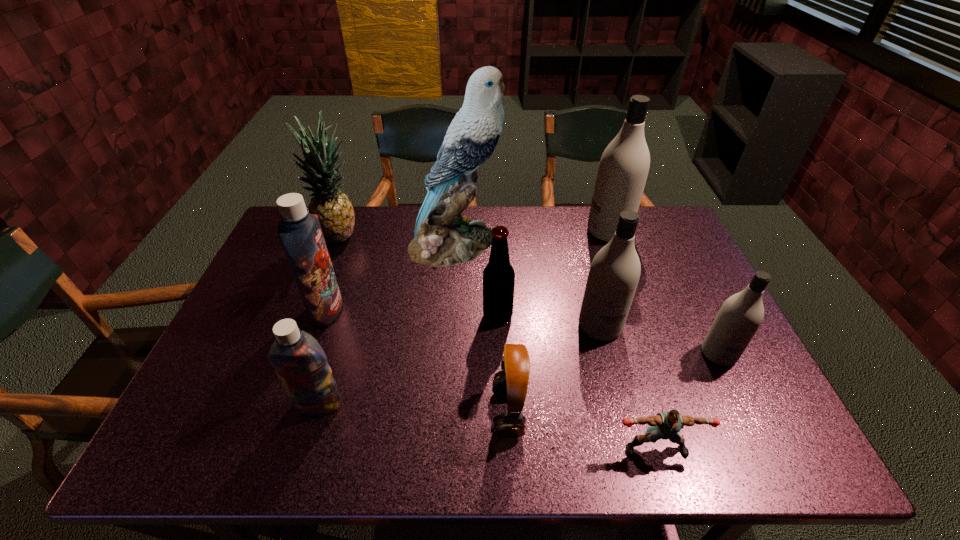
You are a GUI agent. You are given a task and a screenshot of the screen. Output one action in this format:
    pyautogui.click(x=<x>, y=<y>)
    Task: Click on the headset that is at the near edge
    
    Given the screenshot: What is the action you would take?
    pyautogui.click(x=510, y=383)

Where is `puncher that is at the near edge`? This screenshot has width=960, height=540. puncher that is at the near edge is located at coordinates (665, 425).

You are a GUI agent. You are given a task and a screenshot of the screen. Output one action in this format:
    pyautogui.click(x=<x>, y=<y>)
    Task: Click on the object that is at the left edge
    This screenshot has width=960, height=540.
    Given the screenshot: What is the action you would take?
    pyautogui.click(x=335, y=212)

Find the location of a particular element. Image resolution: width=960 pixels, height=540 pixels. object present at the far left corner is located at coordinates (335, 212).

The height and width of the screenshot is (540, 960). In order to click on object that is positioned at the far right corner in this screenshot , I will do `click(624, 165)`.

Where is `free space at the far edge of the desktop`? The image size is (960, 540). free space at the far edge of the desktop is located at coordinates (594, 243).

Find the location of `free space at the near edge of the desktop`. free space at the near edge of the desktop is located at coordinates tap(563, 453).

This screenshot has width=960, height=540. What are the coordinates of `vacant area at the left edge` in the screenshot? It's located at pos(289,266).

Find the location of a particular element. Image resolution: width=960 pixels, height=540 pixels. free location at the right edge is located at coordinates (689, 262).

In the image, there is a desktop. Where is `vacant area at the far right corner`? The height and width of the screenshot is (540, 960). vacant area at the far right corner is located at coordinates (652, 230).